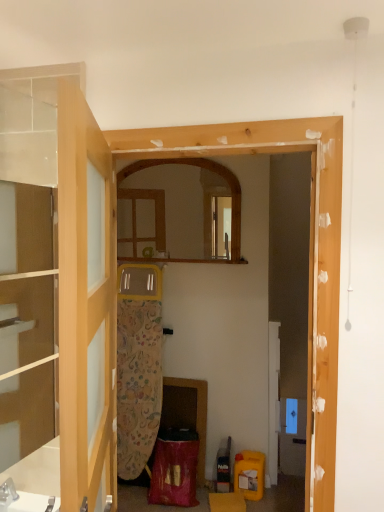
Question: Considering the positions of wooden mirror at center and transparent glass cabinet at left in the image, is wooden mirror at center wider or thinner than transparent glass cabinet at left?

Choices:
 (A) thin
 (B) wide

Answer: (B)

Question: Is wooden mirror at center spatially inside transparent glass cabinet at left, or outside of it?

Choices:
 (A) inside
 (B) outside

Answer: (B)

Question: Considering the real-world distances, which object is farthest from the transparent glass cabinet at left?

Choices:
 (A) wooden mirror at center
 (B) clear glass door at left

Answer: (A)

Question: Which object is the closest to the clear glass door at left?

Choices:
 (A) wooden mirror at center
 (B) transparent glass cabinet at left

Answer: (B)